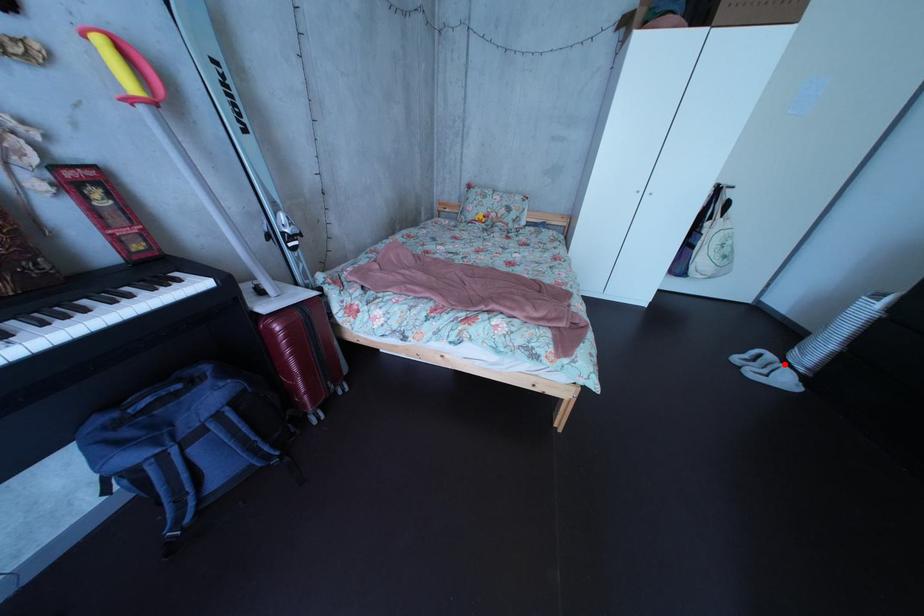
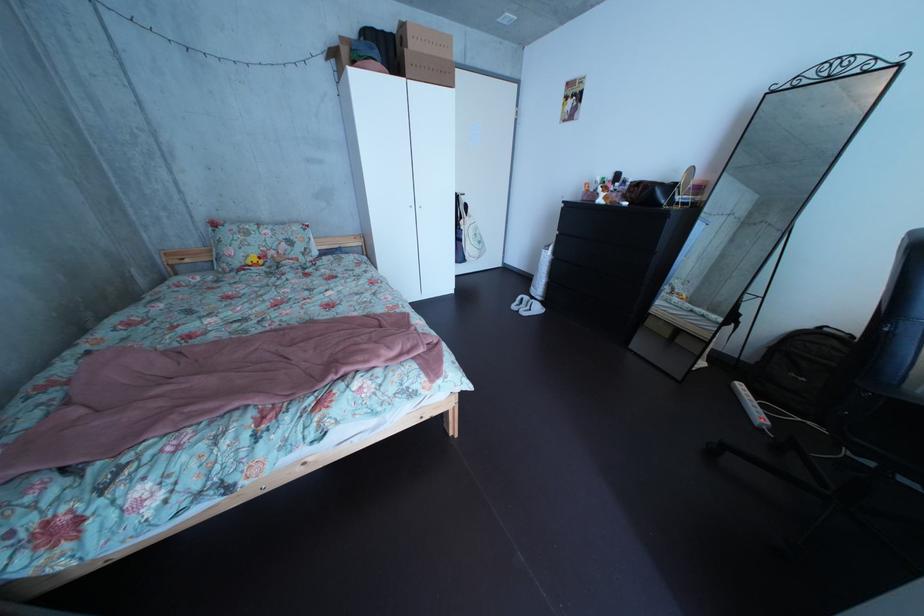
Locate, in the second image, the point that corresponds to the highlighted location in the first image.

(541, 306)